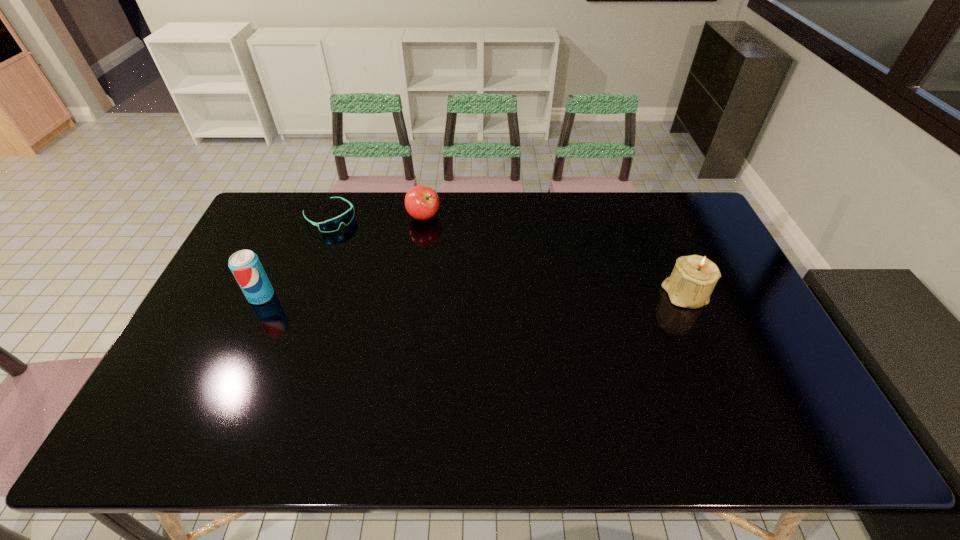
You are a GUI agent. You are given a task and a screenshot of the screen. Output one action in this format:
    pyautogui.click(x=<x>, y=<y>)
    Task: Click on the free space on the desktop that is between the soda can and the rightmost object and is positioned on the stem of the second shortest object
    The image size is (960, 540).
    Given the screenshot: What is the action you would take?
    pyautogui.click(x=421, y=295)

You are a GUI agent. You are given a task and a screenshot of the screen. Output one action in this format:
    pyautogui.click(x=<x>, y=<y>)
    Task: Click on the vacant spot on the desktop that is between the soda can and the rightmost object and is positioned on the front-facing side of the shortest object
    
    Given the screenshot: What is the action you would take?
    pyautogui.click(x=422, y=295)